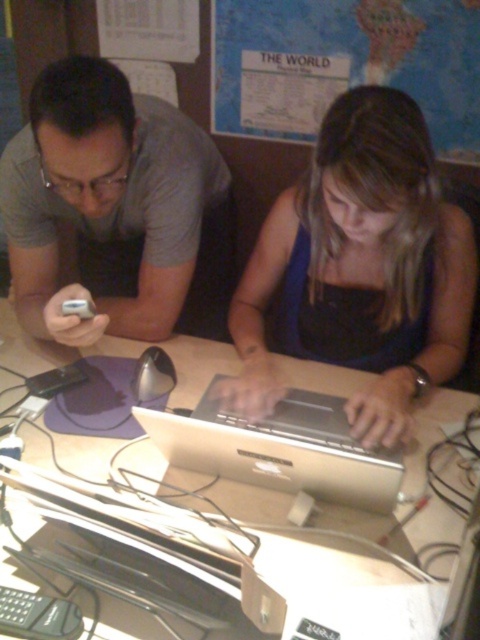
This screenshot has width=480, height=640. Describe the element at coordinates (361, 268) in the screenshot. I see `blue fabric dress at center` at that location.

Does point (338, 128) lie in front of point (337, 428)?

No, it is not.

Is point (418, 157) behind point (285, 419)?

No.

Locate an element on the screen. Image resolution: width=480 pixels, height=640 pixels. blue fabric dress at center is located at coordinates (361, 268).

Can you confirm if blue fabric dress at center is positioned below matte gray shirt at left?

Correct, blue fabric dress at center is located below matte gray shirt at left.

Image resolution: width=480 pixels, height=640 pixels. What are the coordinates of `blue fabric dress at center` in the screenshot? It's located at (361, 268).

The width and height of the screenshot is (480, 640). What do you see at coordinates (361, 268) in the screenshot? I see `blue fabric dress at center` at bounding box center [361, 268].

Find the location of a particular element. This screenshot has width=480, height=640. blue fabric dress at center is located at coordinates (361, 268).

Between point (254, 22) and point (203, 452), which one is positioned behind?

The point (254, 22) is more distant.

Who is positioned more to the right, mappaperbulletin board at upper center or silver metallic laptop at center?

mappaperbulletin board at upper center

Locate an element on the screen. mappaperbulletin board at upper center is located at coordinates (345, 65).